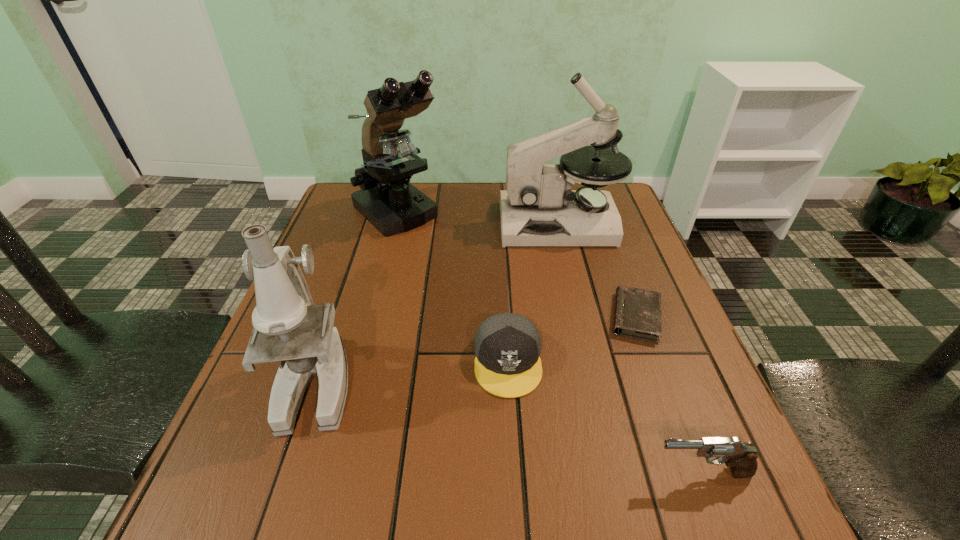
The height and width of the screenshot is (540, 960). Identify the location of object at the far right corner. (538, 208).

Where is `object that is at the near right corner`? This screenshot has width=960, height=540. object that is at the near right corner is located at coordinates tap(741, 458).

You are a GUI agent. You are given a task and a screenshot of the screen. Output one action in this format:
    pyautogui.click(x=<x>, y=<y>)
    Task: Click on the vacant space at the near edge of the desktop
    
    Given the screenshot: What is the action you would take?
    pyautogui.click(x=623, y=518)

The image size is (960, 540). In the image, there is a desktop. Find the location of `free region at the left edge`. free region at the left edge is located at coordinates (254, 387).

You are a GUI agent. You are given a task and a screenshot of the screen. Output one action in this format:
    pyautogui.click(x=<x>, y=<y>)
    Task: Click on the free space at the right edge of the desktop
    The height and width of the screenshot is (540, 960).
    Given the screenshot: What is the action you would take?
    pyautogui.click(x=621, y=248)

Find the location of `free space at the near right corner of the desktop`. free space at the near right corner of the desktop is located at coordinates (655, 488).

At what (x,y) coordinates should I click in order to perform the action: click on empty space between the nearest microscope and the rightmost microscope. Please return your answer as a coordinate pair (x, y). Looking at the image, I should click on (438, 303).

I want to click on free point between the nearest microscope and the third shortest object, so click(x=510, y=428).

Locate an element on the screen. vacant space in between the second shortest object and the shortest object is located at coordinates (572, 339).

You are a GUI agent. You are given a task and a screenshot of the screen. Output one action in this format:
    pyautogui.click(x=<x>, y=<y>)
    Task: Click on the vacant space that is in between the nearest microscope and the fourth tallest object
    The image size is (960, 540).
    Given the screenshot: What is the action you would take?
    pyautogui.click(x=510, y=428)